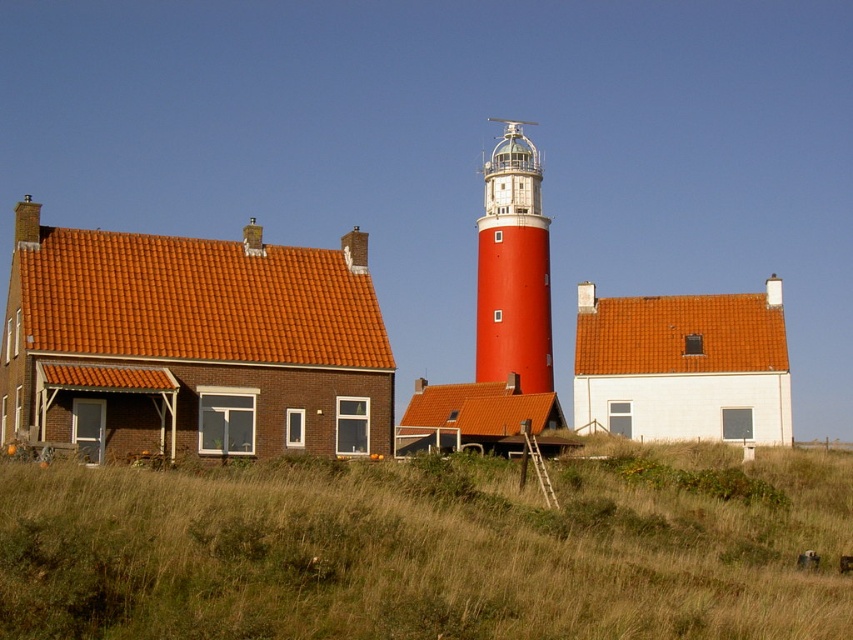
Consider the image. Can you confirm if dry grass at center is positioned below smooth red lighthouse at center?

Yes, dry grass at center is below smooth red lighthouse at center.

Image resolution: width=853 pixels, height=640 pixels. I want to click on dry grass at center, so click(x=428, y=548).